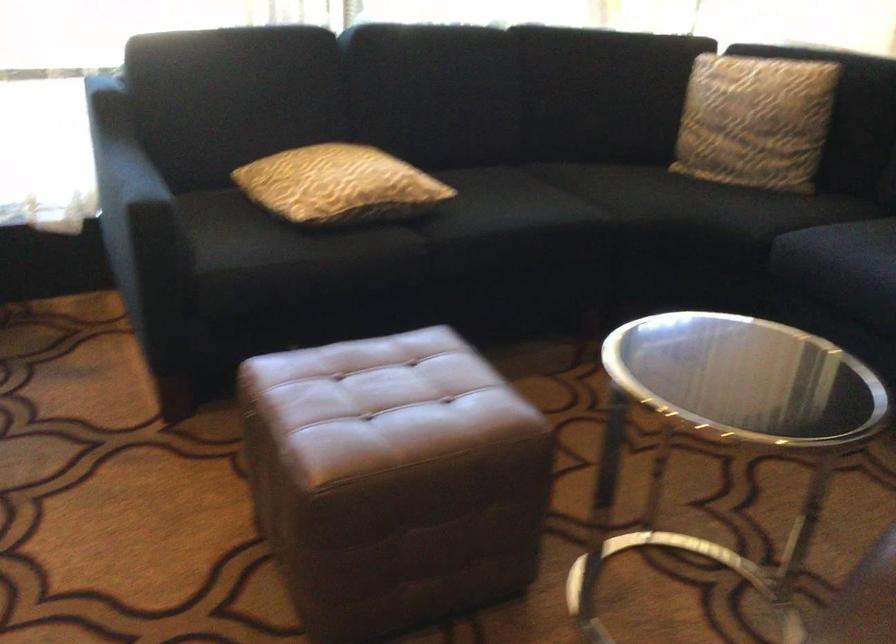
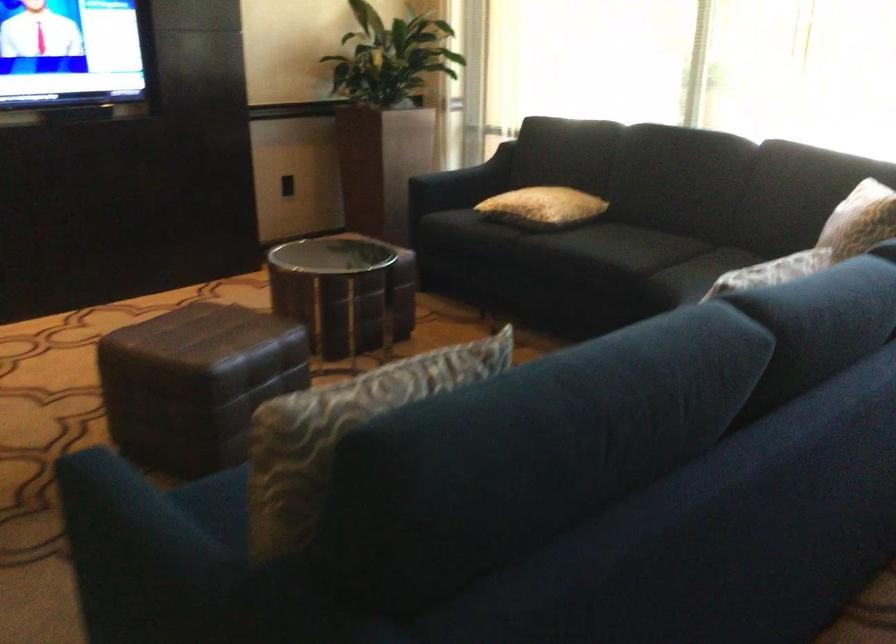
In the second image, find the point that corresponds to (583,204) in the first image.

(626, 254)